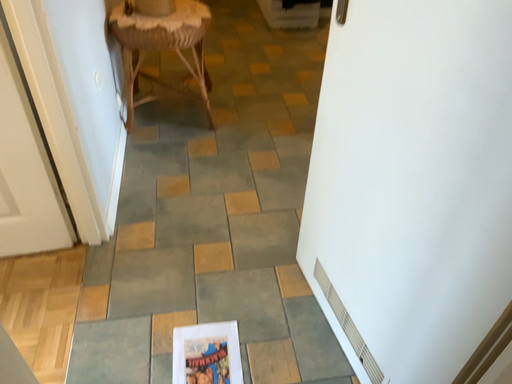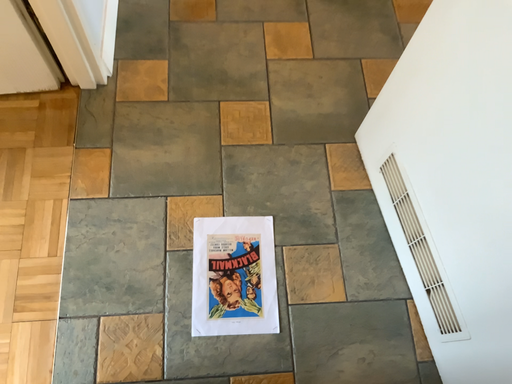
Question: Which way did the camera rotate in the video?

Choices:
 (A) rotated downward
 (B) rotated upward

Answer: (A)